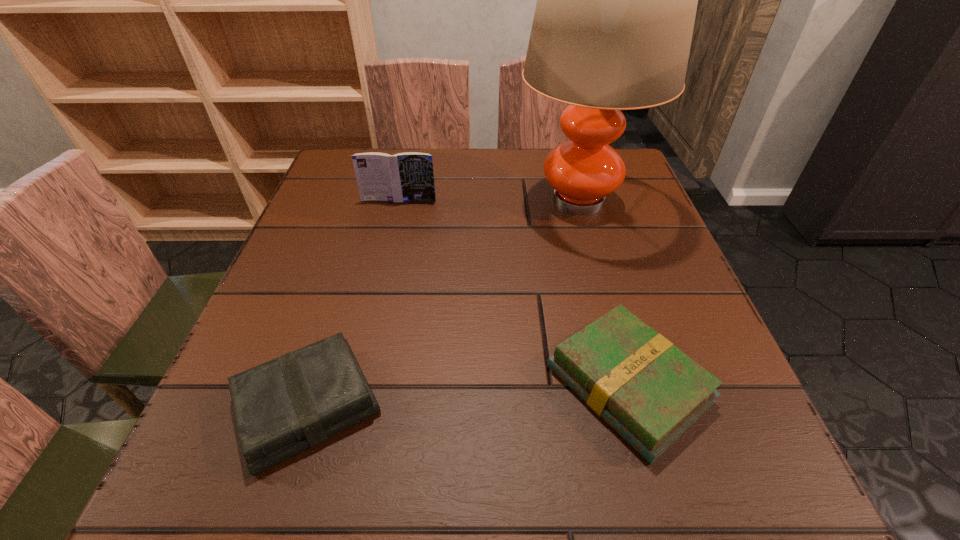
This screenshot has width=960, height=540. Find the location of `the tallest object`. the tallest object is located at coordinates (616, 3).

Identify the location of the second tallest object. The height and width of the screenshot is (540, 960). (408, 176).

Locate an element on the screen. The image size is (960, 540). the tallest book is located at coordinates (408, 176).

At what (x,y) coordinates should I click in order to perform the action: click on the rightmost book. Please return your answer as a coordinate pair (x, y). This screenshot has width=960, height=540. Looking at the image, I should click on (650, 392).

This screenshot has width=960, height=540. What are the coordinates of `vacant point located 0.090m on the back of the lamp` in the screenshot? It's located at (564, 150).

Locate an element on the screen. This screenshot has width=960, height=540. free space located on the front cover of the farthest book is located at coordinates (372, 317).

Image resolution: width=960 pixels, height=540 pixels. In order to click on vacant space located 0.380m on the back of the rightmost book in this screenshot , I will do `click(576, 198)`.

Where is `lamp positioned at the far edge`? The height and width of the screenshot is (540, 960). lamp positioned at the far edge is located at coordinates (616, 3).

Locate an element on the screen. The height and width of the screenshot is (540, 960). book located in the far edge section of the desktop is located at coordinates (408, 176).

Where is `lamp located in the right edge section of the desktop`? The height and width of the screenshot is (540, 960). lamp located in the right edge section of the desktop is located at coordinates (616, 3).